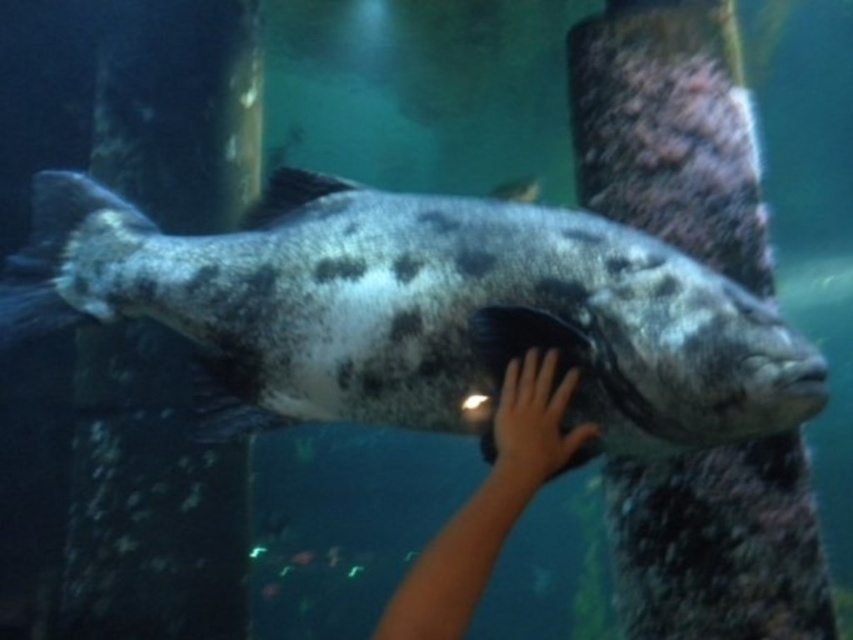
Is speckled gray fish at center smaller than smooth skin hand at center?

No, speckled gray fish at center is not smaller than smooth skin hand at center.

Who is positioned more to the right, speckled gray fish at center or smooth skin hand at center?

smooth skin hand at center

Who is more forward, (426, 422) or (512, 412)?

Positioned in front is point (512, 412).

The height and width of the screenshot is (640, 853). I want to click on speckled gray fish at center, so click(416, 312).